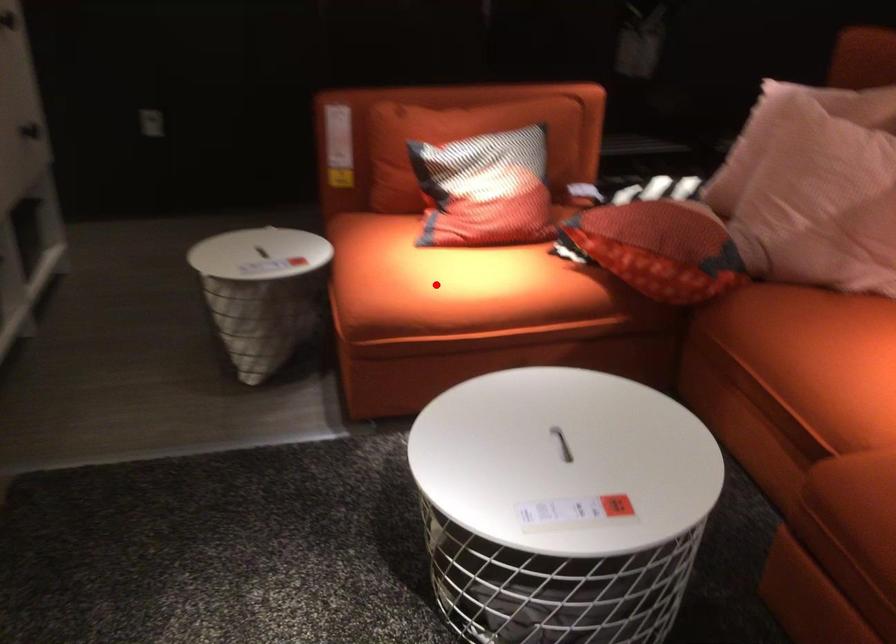
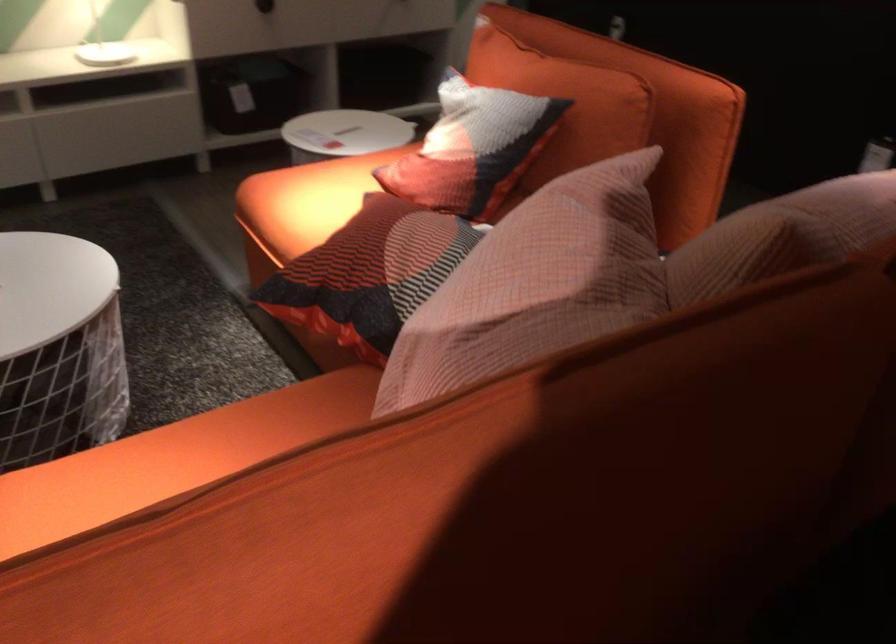
Find the pixel in the second image that matches the highlighted location in the first image.

(306, 200)